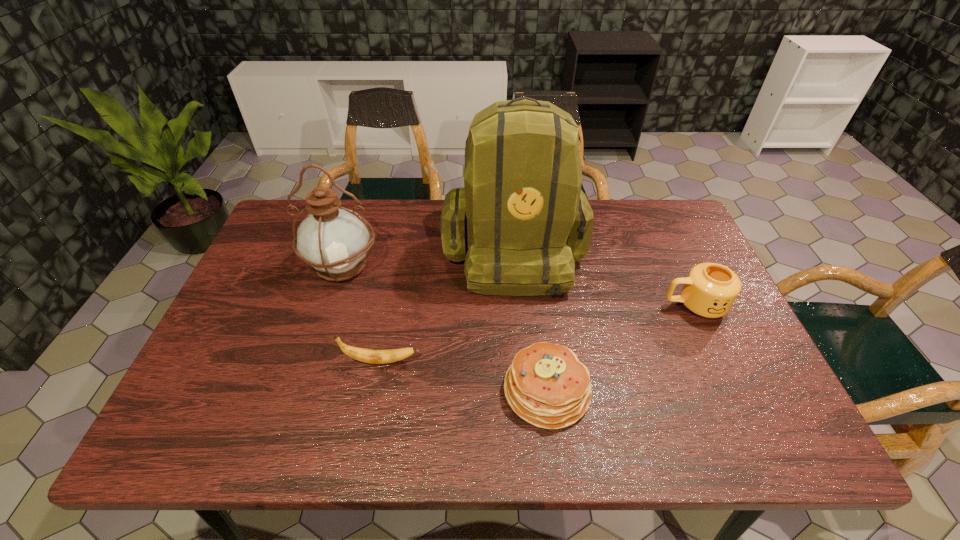
Identify the location of vacant space positioned 0.090m on the handle side of the third tallest object. (629, 305).

Where is `free space located on the peel of the banana from the top`? The width and height of the screenshot is (960, 540). free space located on the peel of the banana from the top is located at coordinates [x=503, y=361].

Locate an element on the screen. The image size is (960, 540). free location located on the right of the pancake is located at coordinates (612, 390).

Locate an element on the screen. Image resolution: width=960 pixels, height=540 pixels. backpack that is at the far edge is located at coordinates (527, 221).

Locate an element on the screen. This screenshot has width=960, height=540. oil lamp positioned at the far edge is located at coordinates (334, 240).

What are the coordinates of `object located at the near edge` in the screenshot? It's located at (546, 385).

Find the location of a particular element. Image resolution: width=960 pixels, height=540 pixels. object at the left edge is located at coordinates (334, 240).

Find the location of a particular element. object positioned at the right edge is located at coordinates [x=710, y=289].

Locate an element on the screen. object that is at the far left corner is located at coordinates (334, 240).

In the image, there is a desktop. Where is `vacant space at the far edge`? This screenshot has width=960, height=540. vacant space at the far edge is located at coordinates (433, 215).